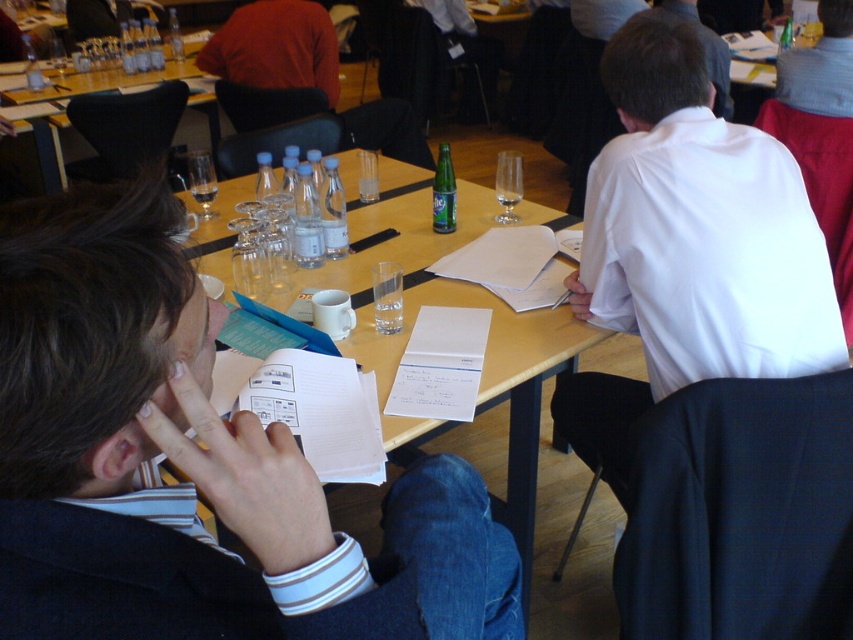
Between point (538, 320) and point (712, 106), which one is positioned in front?

Point (538, 320) is in front.

The image size is (853, 640). What do you see at coordinates (485, 388) in the screenshot?
I see `wooden table at center` at bounding box center [485, 388].

Between point (596, 566) and point (711, 76), which one is positioned in front?

Point (596, 566) is more forward.

Find the location of a particular element. wooden table at center is located at coordinates (485, 388).

Can you confirm if white shirt at upper right is positioned below transparent glass at table center?

Incorrect, white shirt at upper right is not positioned below transparent glass at table center.

Is white shirt at upper right smaller than transparent glass at table center?

No.

Between point (726, 44) and point (503, 177), which one is positioned in front?

Point (503, 177) is more forward.

This screenshot has width=853, height=640. What are the coordinates of `white shirt at upper right` in the screenshot? It's located at (704, 51).

Between white smooth shirt at upper right and transparent glass at table center, which one appears on the right side from the viewer's perspective?

Positioned to the right is white smooth shirt at upper right.

Does white smooth shirt at upper right lie in front of transparent glass at table center?

Yes, it is.

This screenshot has height=640, width=853. Find the location of `white smooth shirt at upper right`. white smooth shirt at upper right is located at coordinates (688, 248).

Where is `white smooth shirt at upper right`? white smooth shirt at upper right is located at coordinates (688, 248).